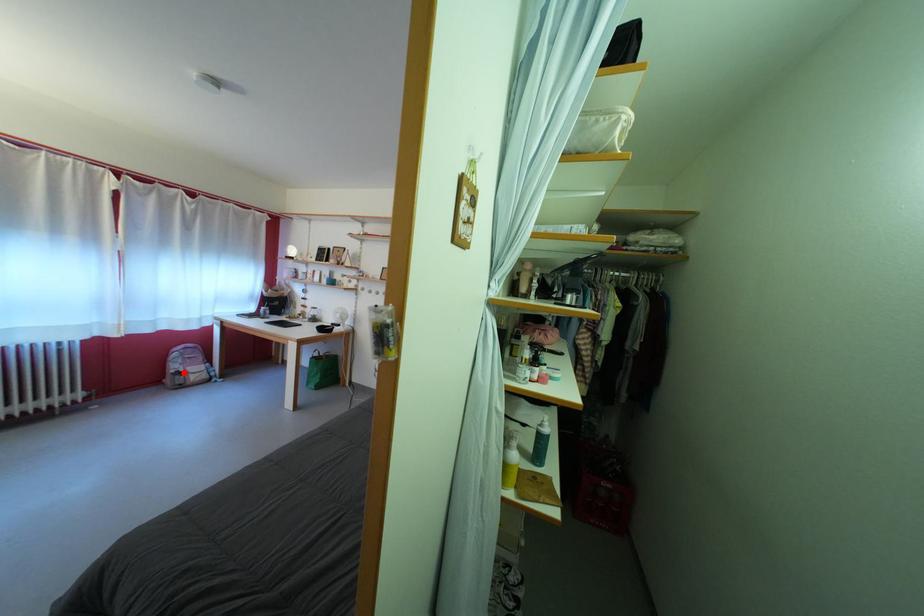
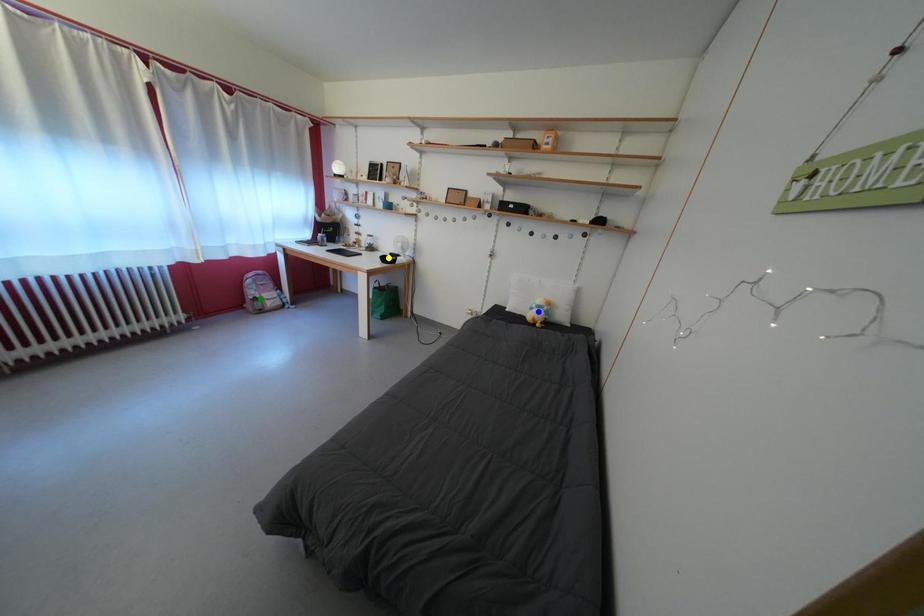
Question: I am providing you with two images of the same scene from different viewpoints. A red point is marked on the first image. You are given multiple points on the second image. Which mark in image 2 goes with the point in image 1?

Choices:
 (A) blue point
 (B) yellow point
 (C) green point

Answer: (C)